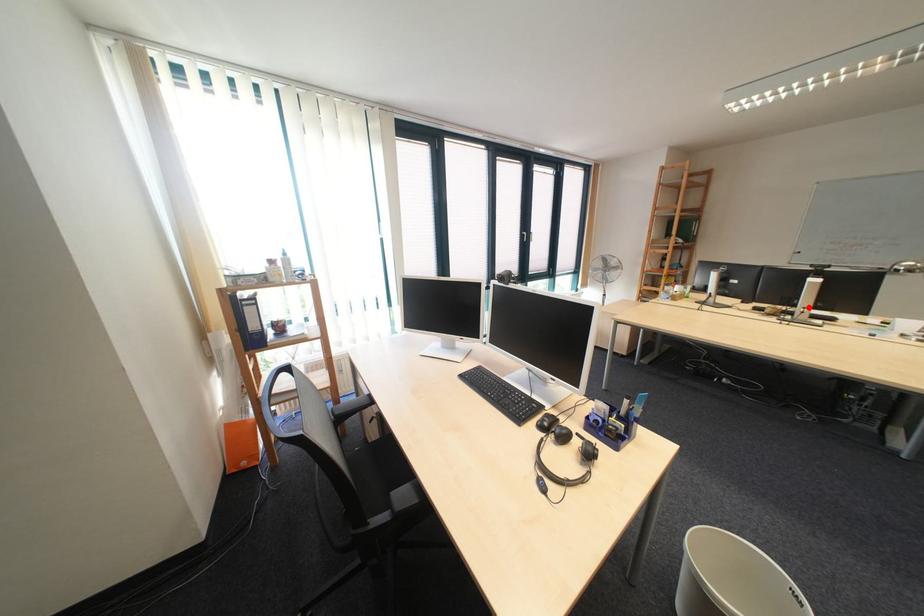
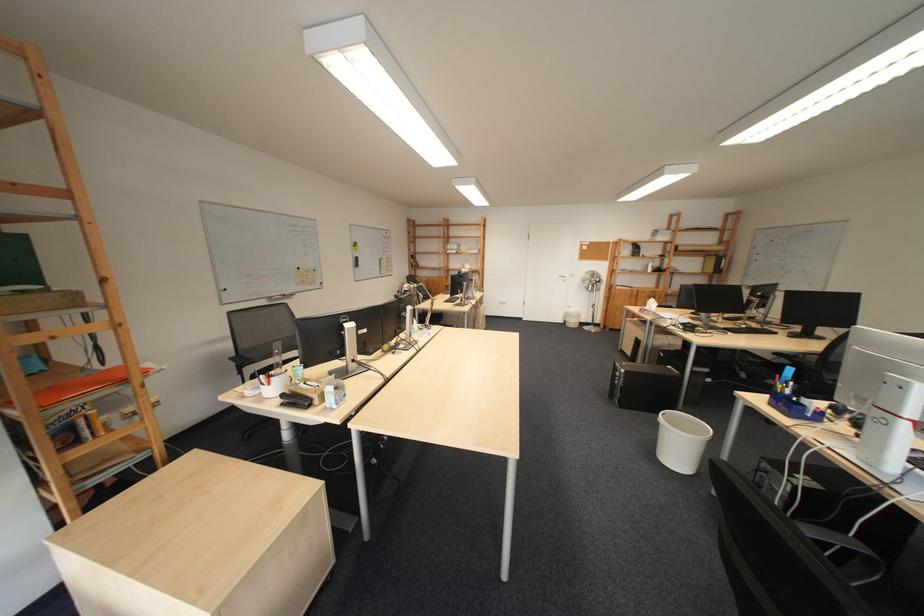
Question: I am providing you with two images of the same scene from different viewpoints. A red point is marked on the first image. Can you still see the location of the red point in image 2?

Choices:
 (A) Yes
 (B) No

Answer: (B)